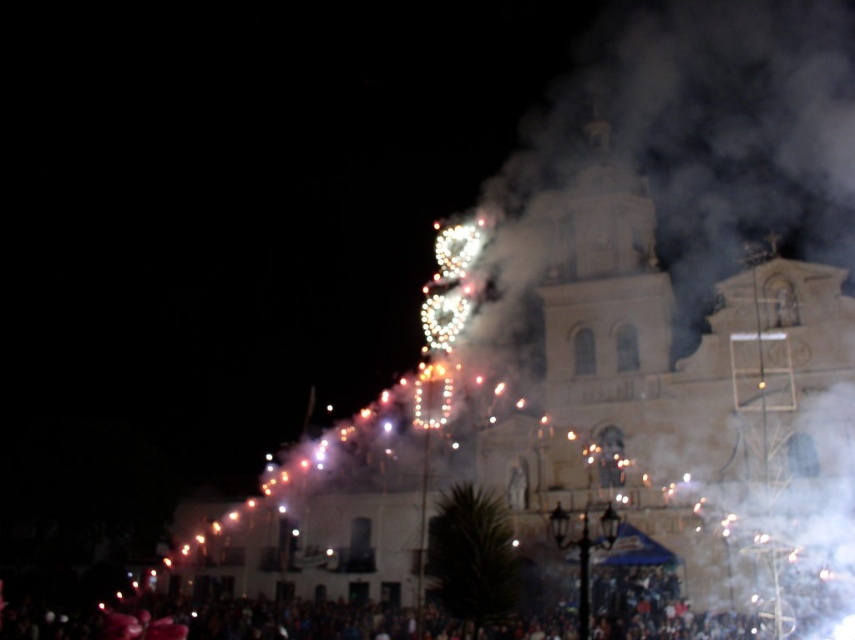
You are standing in front of the grand building and see two points marked on the facade. The first point is at coordinates point (612,170) and the second is at point (626,632). Which point is closer to you?

Point (626,632) is closer to you because it is less further to the camera than point (612,170).

You are a photographer trying to capture the white stone church at center and the dark clothing crowd at lower center in a single shot. Based on their relative heights, which object should you focus on first to ensure both are in frame?

The white stone church at center is taller than the dark clothing crowd at lower center. To ensure both are in frame, focus on the white stone church at center first as it occupies more vertical space.